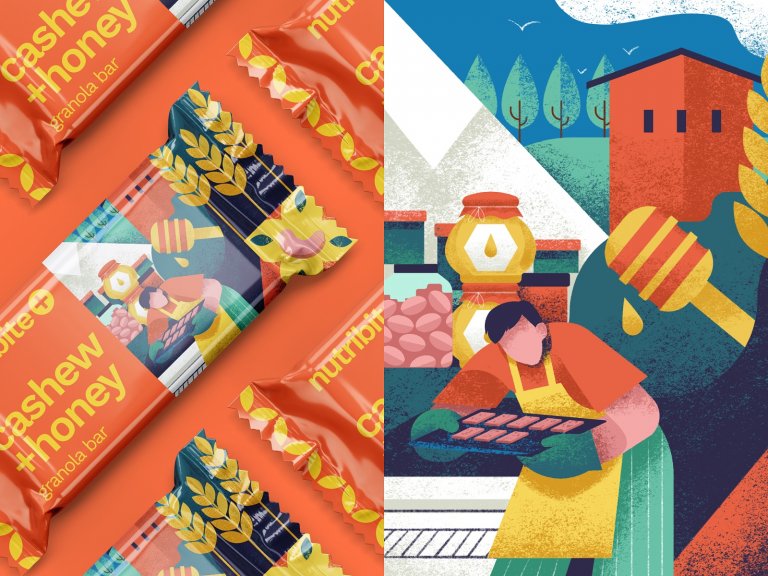
Where is `tray`? tray is located at coordinates (521, 454).